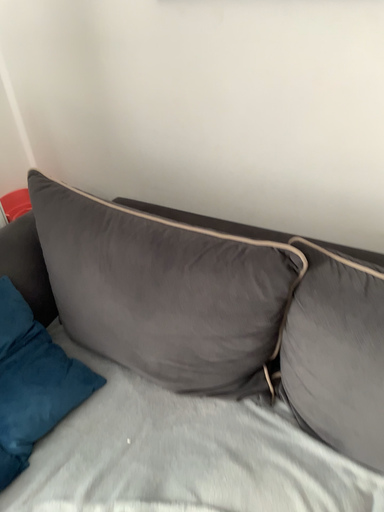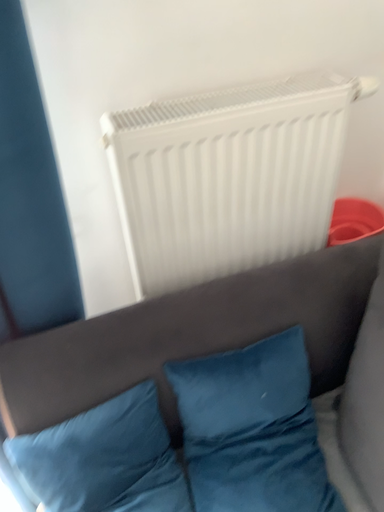
Question: Which way did the camera rotate in the video?

Choices:
 (A) rotated right
 (B) rotated left

Answer: (B)